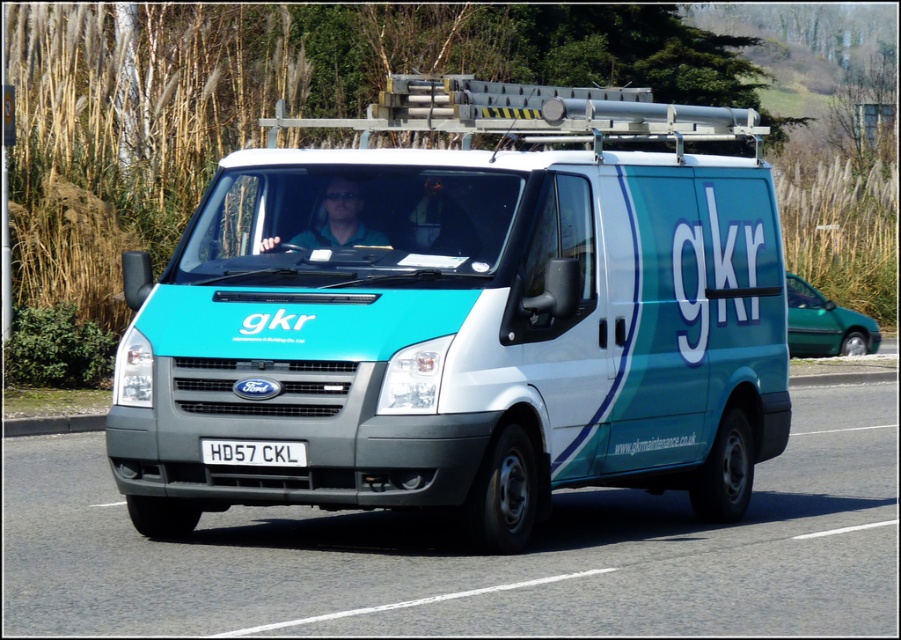
You are a delivery driver who needs to park the teal matte van at center in a parking spot that is exactly the same width as the white plastic license plate at center. Will the van fit in the parking spot?

The teal matte van at center is wider than the white plastic license plate at center, so it will not fit in the parking spot.

You are a pedestrian standing on the sidewalk observing the teal matte van at center and the matte green shirt at center. Which object is nearer to you?

The teal matte van at center is closer to the viewer than the matte green shirt at center.